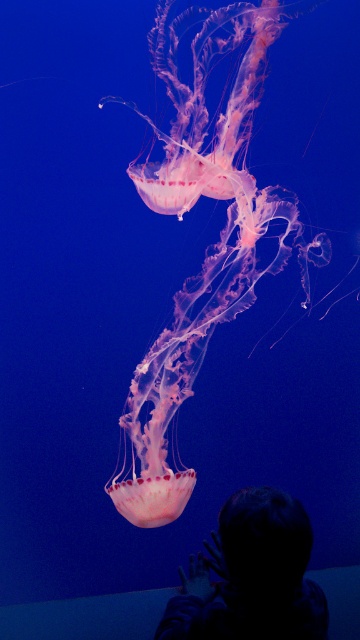
Question: Can you confirm if translucent pink jellyfish at center is positioned to the left of silhouette hair at lower center?

Choices:
 (A) no
 (B) yes

Answer: (B)

Question: Can you confirm if translucent pink jellyfish at center is positioned above silhouette hair at lower center?

Choices:
 (A) yes
 (B) no

Answer: (A)

Question: Which of the following is the closest to the observer?

Choices:
 (A) translucent pink jellyfish at center
 (B) silhouette hair at lower center

Answer: (B)

Question: Which object appears closest to the camera in this image?

Choices:
 (A) silhouette hair at lower center
 (B) translucent pink jellyfish at center

Answer: (A)

Question: Which point is closer to the camera taking this photo?

Choices:
 (A) (273, 506)
 (B) (146, 168)

Answer: (A)

Question: Does translucent pink jellyfish at center have a larger size compared to silhouette hair at lower center?

Choices:
 (A) yes
 (B) no

Answer: (A)